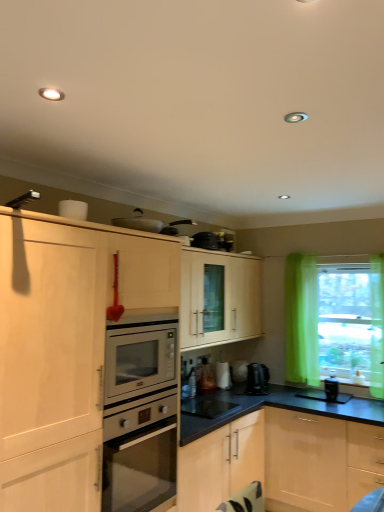
Question: Does satin black coffee machine at lower center come in front of black glossy microwave at center, positioned as the 2th appliance in left-to-right order?

Choices:
 (A) no
 (B) yes

Answer: (A)

Question: Is satin black coffee machine at lower center positioned beyond the bounds of black glossy microwave at center, placed as the third appliance when sorted from back to front?

Choices:
 (A) yes
 (B) no

Answer: (A)

Question: Can you confirm if satin black coffee machine at lower center is positioned to the right of black glossy microwave at center, arranged as the 4th appliance when viewed from the top?

Choices:
 (A) no
 (B) yes

Answer: (B)

Question: Does satin black coffee machine at lower center have a greater width compared to black glossy microwave at center, placed as the third appliance when sorted from back to front?

Choices:
 (A) yes
 (B) no

Answer: (B)

Question: Does satin black coffee machine at lower center have a lesser width compared to black glossy microwave at center, placed as the third appliance when sorted from back to front?

Choices:
 (A) no
 (B) yes

Answer: (B)

Question: Does satin black coffee machine at lower center have a greater height compared to black glossy microwave at center, which is the first appliance in bottom-to-top order?

Choices:
 (A) yes
 (B) no

Answer: (A)

Question: Can you confirm if white glossy kettle at lower center, which ranks as the third appliance in bottom-to-top order, is positioned to the left of metallic silver toaster at upper center, which appears as the 4th appliance when viewed from the back?

Choices:
 (A) yes
 (B) no

Answer: (B)

Question: Does white glossy kettle at lower center, arranged as the 1th appliance when viewed from the back, have a greater width compared to metallic silver toaster at upper center, the first appliance viewed from the front?

Choices:
 (A) yes
 (B) no

Answer: (B)

Question: Considering the relative sizes of white glossy kettle at lower center, placed as the second appliance when sorted from right to left, and metallic silver toaster at upper center, which appears as the 4th appliance when viewed from the back, in the image provided, is white glossy kettle at lower center, placed as the second appliance when sorted from right to left, taller than metallic silver toaster at upper center, which appears as the 4th appliance when viewed from the back,?

Choices:
 (A) yes
 (B) no

Answer: (A)

Question: Could you tell me if white glossy kettle at lower center, which ranks as the third appliance in bottom-to-top order, is turned towards metallic silver toaster at upper center, the first appliance positioned from the left?

Choices:
 (A) no
 (B) yes

Answer: (A)

Question: Does white glossy kettle at lower center, placed as the second appliance when sorted from right to left, touch metallic silver toaster at upper center, the first appliance viewed from the front?

Choices:
 (A) yes
 (B) no

Answer: (B)

Question: Can you confirm if white glossy kettle at lower center, which ranks as the fourth appliance in front-to-back order, is bigger than metallic silver toaster at upper center, which appears as the 4th appliance when viewed from the back?

Choices:
 (A) yes
 (B) no

Answer: (B)

Question: Can you confirm if black plastic coffee maker at lower right, arranged as the 1th appliance when viewed from the right, is bigger than translucent green curtain at right?

Choices:
 (A) no
 (B) yes

Answer: (A)